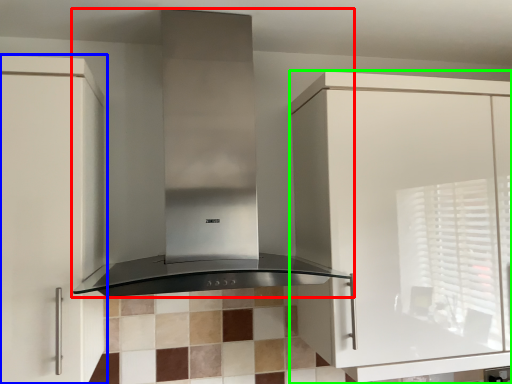
Question: Considering the real-world distances, which object is closest to home appliance (highlighted by a red box)? cabinetry (highlighted by a blue box) or cabinetry (highlighted by a green box).

Choices:
 (A) cabinetry
 (B) cabinetry

Answer: (A)